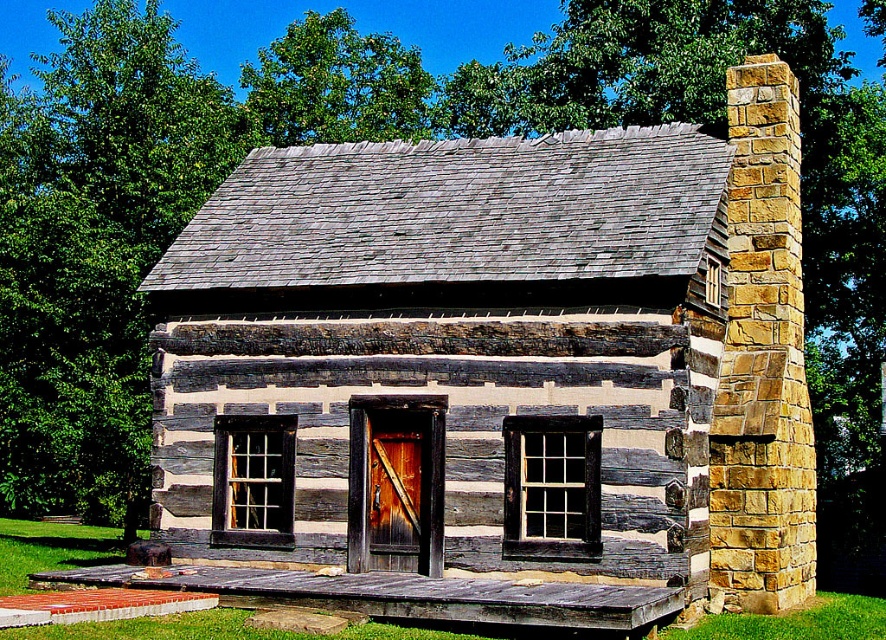
Question: Can you confirm if weathered wood cabin at center is wider than brown wooden door at center?

Choices:
 (A) yes
 (B) no

Answer: (A)

Question: Which of the following is the closest to the observer?

Choices:
 (A) weathered wood cabin at center
 (B) brown wooden door at center

Answer: (A)

Question: From the image, what is the correct spatial relationship of weathered wood cabin at center in relation to brown wooden door at center?

Choices:
 (A) below
 (B) above

Answer: (B)

Question: Which point is farther from the camera taking this photo?

Choices:
 (A) (418, 481)
 (B) (284, 339)

Answer: (B)

Question: Does weathered wood cabin at center have a lesser width compared to brown wooden door at center?

Choices:
 (A) yes
 (B) no

Answer: (B)